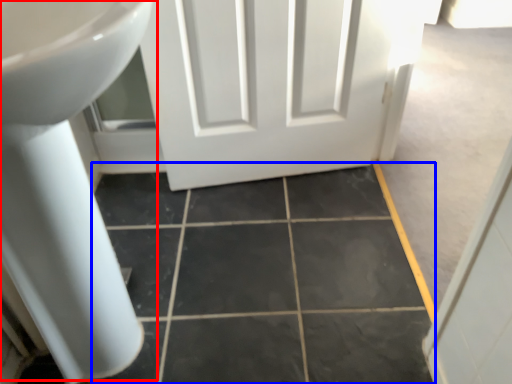
Question: Which object is further to the camera taking this photo, sink (highlighted by a red box) or ceramic tile (highlighted by a blue box)?

Choices:
 (A) sink
 (B) ceramic tile

Answer: (B)